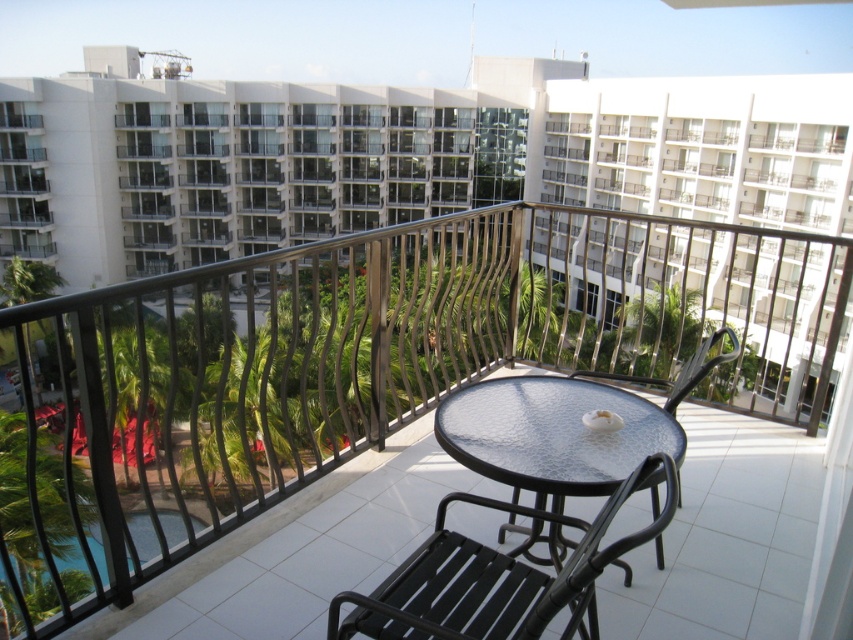
You are standing on the balcony and want to place a potted plant on the textured glass table at center. However, you notice the clear glass pool at lower left below it. Is the table directly above the pool?

Yes, the textured glass table at center is positioned over clear glass pool at lower left, so placing the potted plant there would be directly above the pool.

Based on the photo, you are a delivery person trying to place a heavy box on the textured glass table at center. The box is 1.2 meters tall. Can you safely place it there without it touching the black metal chair at lower right?

The textured glass table at center has a lesser height compared to black metal chair at lower right. Since the table is shorter, the box placed on it will not reach the height of the chair, so it can be safely placed without touching the black metal chair at lower right.